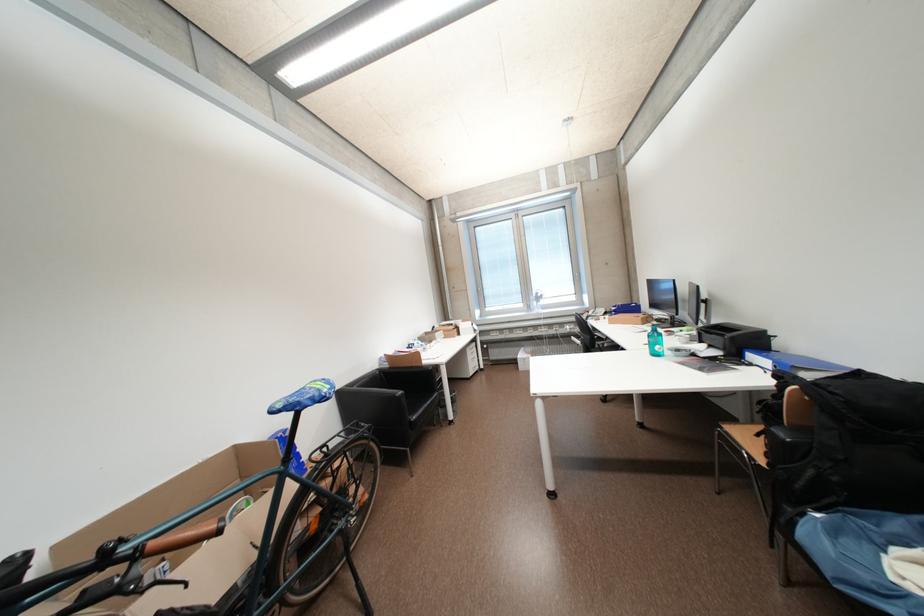
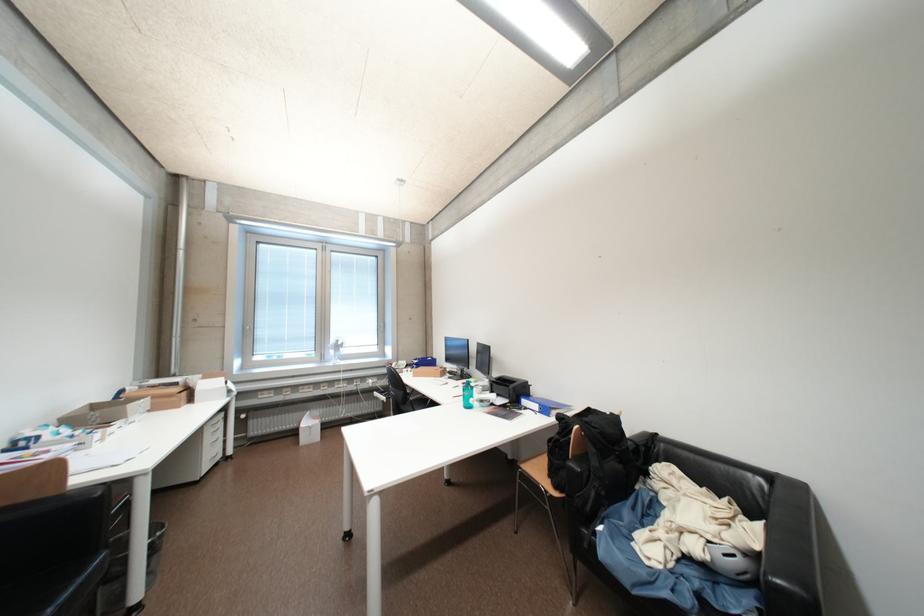
Question: I am providing you with two images of the same scene from different viewpoints. Please identify which objects are invisible in image2.

Choices:
 (A) grey helmet
 (B) sofa armrest
 (C) chair sitting surface
 (D) none of these

Answer: (D)